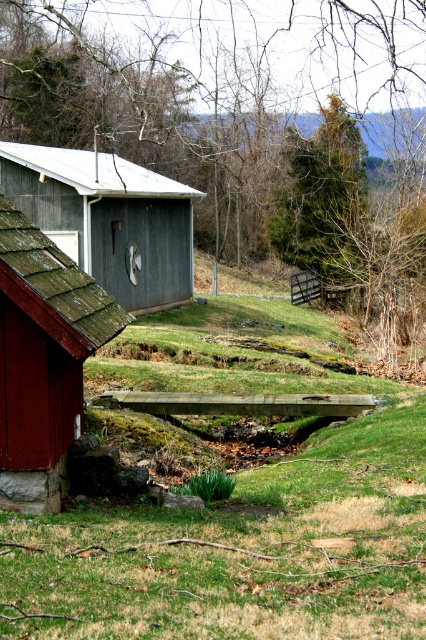
You are a hiker who wants to take a photo of the rustic wood hut at lower left and the green mossy shed at upper left. Which object should you focus on first if you want to capture both in a single frame without moving your camera?

You should focus on the rustic wood hut at lower left first because it is located below the green mossy shed at upper left, so adjusting the camera to include both would require ensuring the lower object is framed first.

You are a hiker who wants to take a photo of both the rustic wood hut at lower left and the green mossy shed at upper left. Which one should you stand closer to in order to capture both in the same frame?

You should stand closer to the rustic wood hut at lower left because it is shorter than the green mossy shed at upper left, allowing both to fit within the camera frame when positioned nearer to the shorter object.